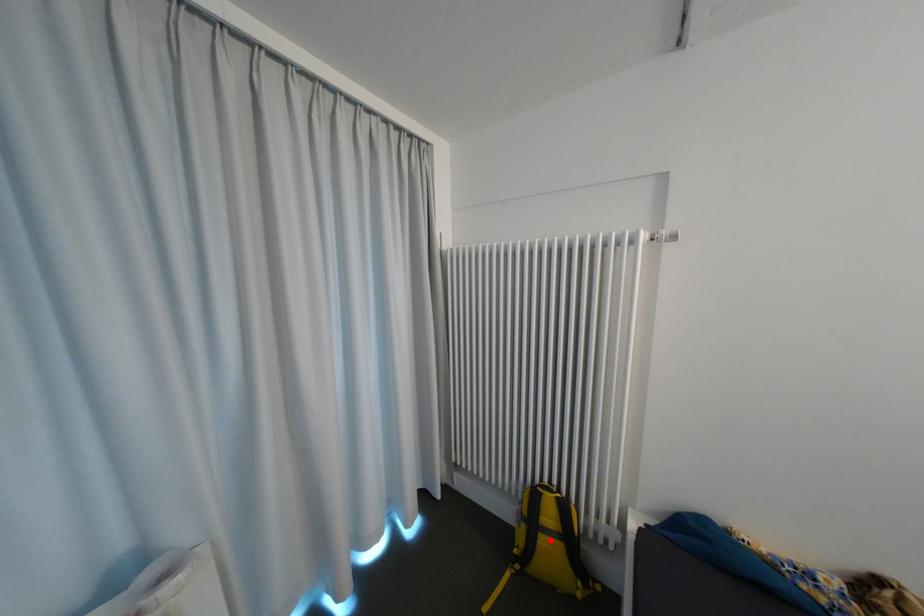
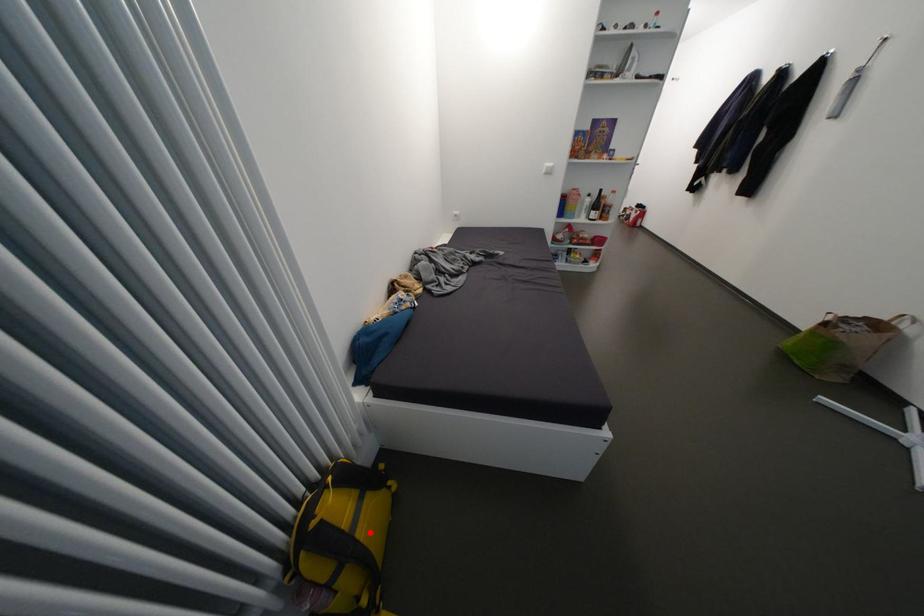
I am providing you with two images of the same scene from different viewpoints. A red point is marked on the first image and another point is marked on the second image. Does the point marked in image1 correspond to the same location as the one in image2?

Yes